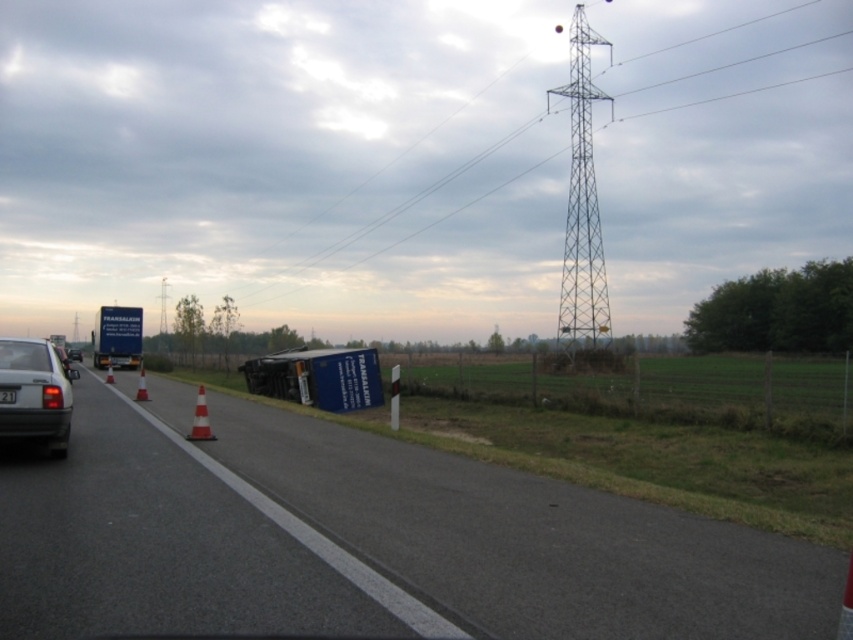
You are a tow truck operator needing to attach a cable to the black plastic license plate at center and the matte gray sedan at left. Given that your cable is 1.5 meters long, will it be sufficient to connect them?

The distance between the matte gray sedan at left and the black plastic license plate at center is 1.34 meters. Since the cable is 1.5 meters long, it will be sufficient to connect them as the cable is longer than the required distance.

You are a drone operator trying to capture aerial footage of the accident scene. You have two points marked on your screen, point (138,378) and point (109,369). Which point is closer to your drone camera?

Point (138,378) is closer to the camera than point (109,369).